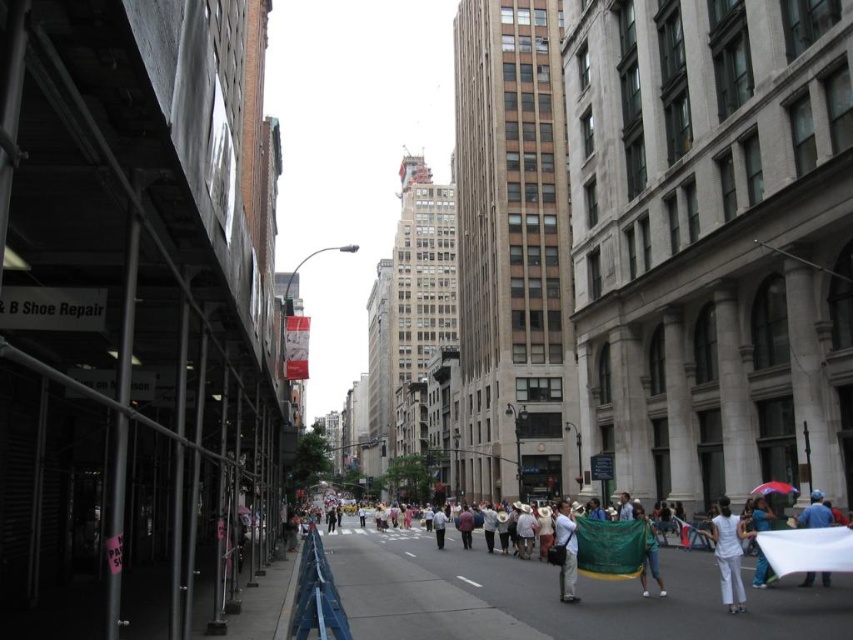
Question: Can you confirm if concrete sidewalk at center is smaller than denim pants at lower right?

Choices:
 (A) no
 (B) yes

Answer: (A)

Question: In this image, where is white cotton dress at lower right located relative to blue fabric at center?

Choices:
 (A) left
 (B) right

Answer: (A)

Question: Does concrete sidewalk at center appear over denim pants at lower right?

Choices:
 (A) no
 (B) yes

Answer: (A)

Question: Which point is farther to the camera?

Choices:
 (A) 656,582
 (B) 796,522

Answer: (B)

Question: Among these points, which one is nearest to the camera?

Choices:
 (A) (759, 516)
 (B) (808, 504)
 (C) (753, 634)

Answer: (C)

Question: Which object is farther from the camera taking this photo?

Choices:
 (A) white cotton shirt at center
 (B) white cotton dress at lower right
 (C) white matte umbrella at lower right

Answer: (A)